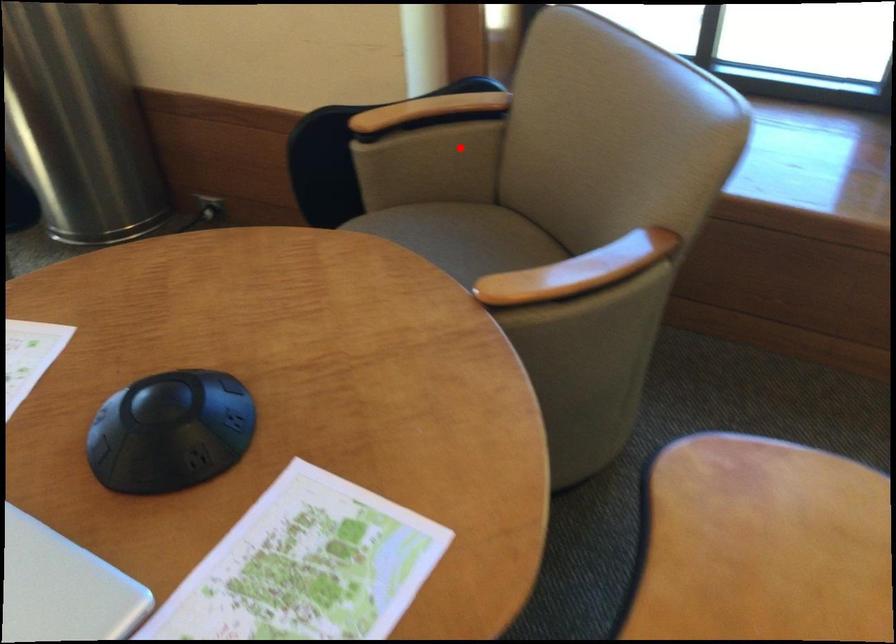
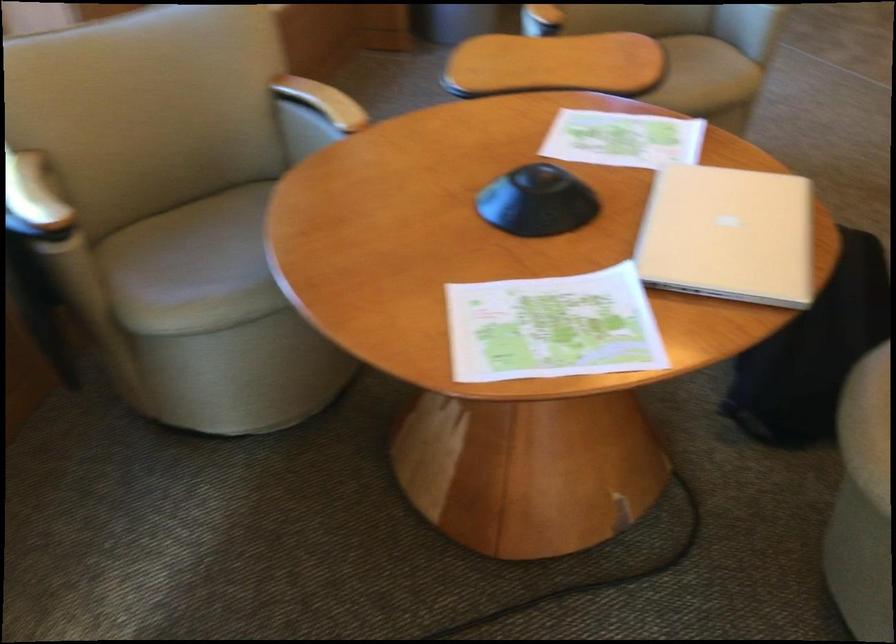
Question: I am providing you with two images of the same scene from different viewpoints. Given a red point in image1, look at the same physical point in image2. Is it:

Choices:
 (A) Closer to the viewpoint
 (B) Farther from the viewpoint

Answer: (A)